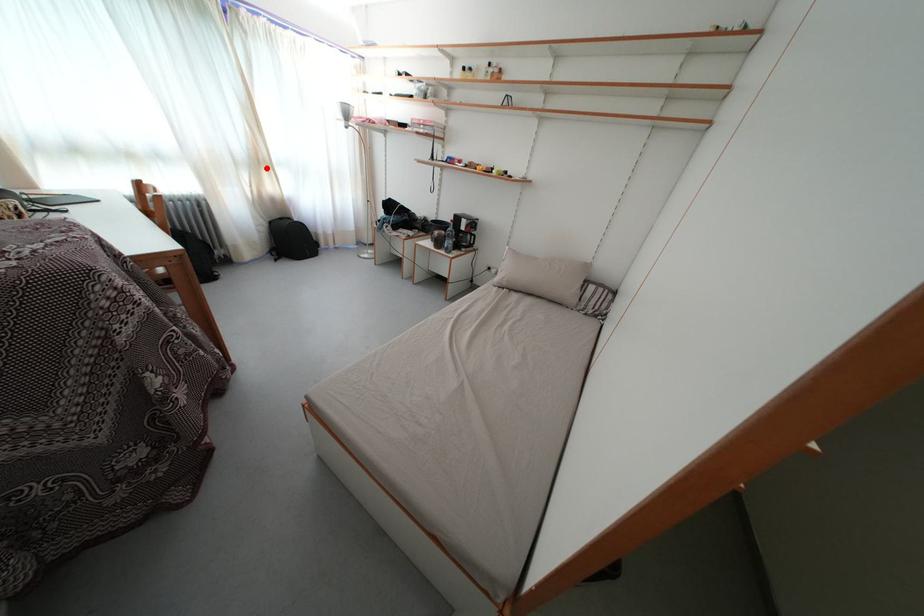
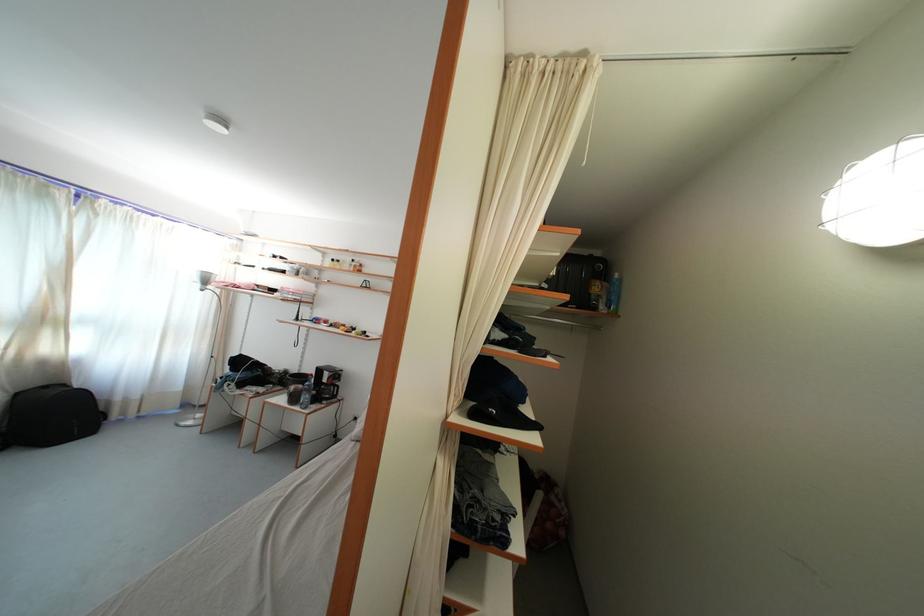
Question: I am providing you with two images of the same scene from different viewpoints. Given a red point in image1, look at the same physical point in image2. Is it:

Choices:
 (A) Closer to the viewpoint
 (B) Farther from the viewpoint

Answer: (B)